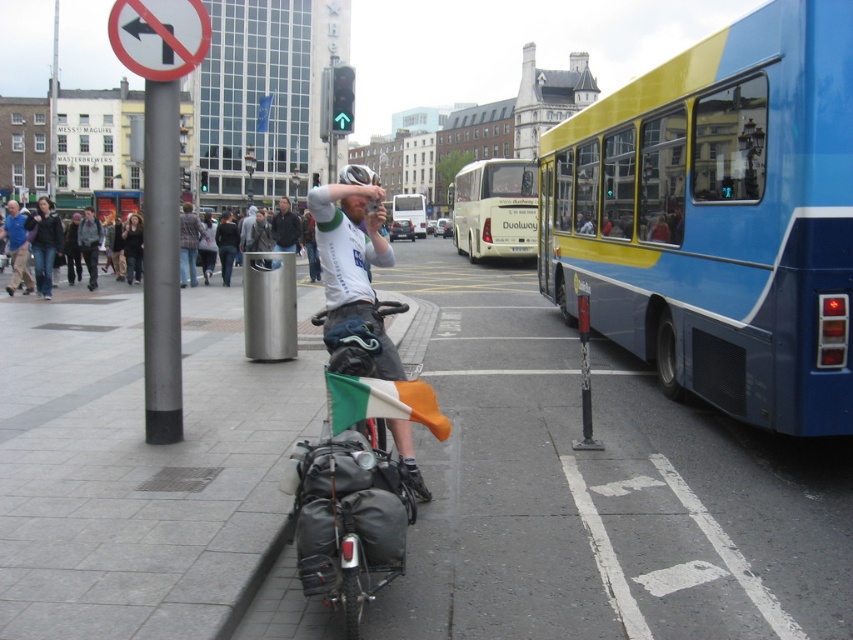
Question: Based on their relative distances, which object is nearer to the yellow/white plastic bus at center?

Choices:
 (A) white fabric shirt at center
 (B) dark blue jeans at left
 (C) white plastic sign at upper left

Answer: (A)

Question: Considering the real-world distances, which object is closest to the dark blue jeans at left?

Choices:
 (A) blue metallic bus at right
 (B) black metal pole at left
 (C) brushed metal trash can at center

Answer: (C)

Question: Is white plastic sign at upper left wider than brushed metal trash can at center?

Choices:
 (A) yes
 (B) no

Answer: (A)

Question: Does black metal pole at left appear on the left side of dark gray jacket at center?

Choices:
 (A) no
 (B) yes

Answer: (A)

Question: Among these objects, which one is nearest to the camera?

Choices:
 (A) white fabric shirt at center
 (B) dark blue jeans at left
 (C) yellow and blue bus at center
 (D) irish flag at center

Answer: (D)

Question: Can you confirm if blue metallic bus at right is wider than white plastic sign at upper left?

Choices:
 (A) no
 (B) yes

Answer: (A)